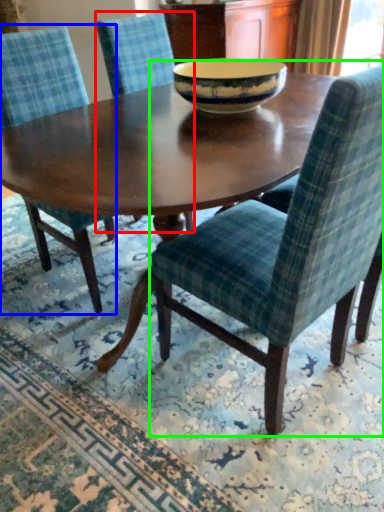
Question: Estimate the real-world distances between objects in this image. Which object is farther from chair (highlighted by a red box), chair (highlighted by a blue box) or chair (highlighted by a green box)?

Choices:
 (A) chair
 (B) chair

Answer: (B)